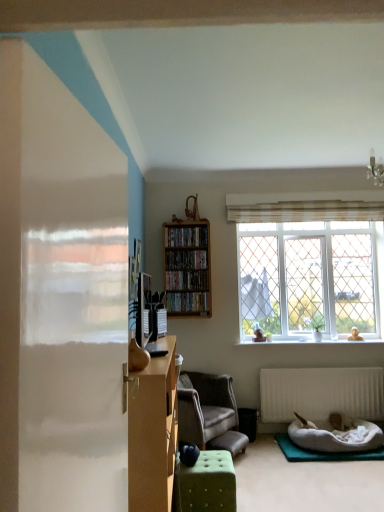
At what (x,y) coordinates should I click in order to perform the action: click on velvet grey armchair at center. Please return your answer as a coordinate pair (x, y). The width and height of the screenshot is (384, 512). Looking at the image, I should click on (209, 413).

The height and width of the screenshot is (512, 384). What do you see at coordinates (187, 280) in the screenshot?
I see `wooden bookshelf at center, acting as the 2th shelf starting from the top` at bounding box center [187, 280].

Where is `green fabric yoga mat at lower right`? This screenshot has width=384, height=512. green fabric yoga mat at lower right is located at coordinates (323, 452).

In order to click on white plush pet bed at lower right in this screenshot , I will do `click(336, 436)`.

Describe the element at coordinates (188, 302) in the screenshot. This screenshot has height=512, width=384. I see `wooden bookshelf at center, the 3th shelf positioned from the top` at that location.

Where is `velvet grey armchair at center`? The width and height of the screenshot is (384, 512). velvet grey armchair at center is located at coordinates pyautogui.click(x=209, y=413).

Between point (208, 443) and point (206, 252), which one is positioned behind?

The point (206, 252) is farther.

In the scene shown: Is green tufted ottoman at center positioned with its back to wooden bookshelf at center, placed as the 2th cabinet when sorted from top to bottom?

No, green tufted ottoman at center's orientation is not away from wooden bookshelf at center, placed as the 2th cabinet when sorted from top to bottom.

From the image's perspective, who appears lower, green tufted ottoman at center or wooden bookshelf at center, positioned as the 1th cabinet in bottom-to-top order?

green tufted ottoman at center appears lower in the image.

Who is smaller, green tufted ottoman at center or wooden bookshelf at center, placed as the 2th cabinet when sorted from top to bottom?

Smaller between the two is wooden bookshelf at center, placed as the 2th cabinet when sorted from top to bottom.

Is point (186, 432) closer or farther from the camera than point (188, 288)?

Point (186, 432) appears to be closer to the viewer than point (188, 288).

Identify the location of chair that is under the wooden bookshelf at center, acting as the 2th shelf starting from the top (from a real-world perspective). The height and width of the screenshot is (512, 384). (209, 413).

Is velvet grey armchair at center next to wooden bookshelf at center, the 2th shelf when ordered from bottom to top, and touching it?

velvet grey armchair at center and wooden bookshelf at center, the 2th shelf when ordered from bottom to top, are clearly separated.

From the image's perspective, which one is positioned lower, velvet grey armchair at center or wooden bookshelf at center, the 2th shelf when ordered from bottom to top?

velvet grey armchair at center.

Is wooden bookshelf at upper center, which appears as the first cabinet when viewed from the top, in front of wooden bookshelf at center, placed as the 2th cabinet when sorted from top to bottom?

No, it is not.

Based on the photo, can you confirm if wooden bookshelf at upper center, the second cabinet in the bottom-to-top sequence, is taller than wooden bookshelf at center, placed as the 2th cabinet when sorted from top to bottom?

Yes, wooden bookshelf at upper center, the second cabinet in the bottom-to-top sequence, is taller than wooden bookshelf at center, placed as the 2th cabinet when sorted from top to bottom.

Are wooden bookshelf at upper center, which appears as the first cabinet when viewed from the top, and wooden bookshelf at center, positioned as the 1th cabinet in bottom-to-top order, beside each other?

No.

From the image's perspective, which is above, wooden bookshelf at upper center, which appears as the first cabinet when viewed from the top, or wooden bookshelf at center, placed as the 2th cabinet when sorted from top to bottom?

wooden bookshelf at upper center, which appears as the first cabinet when viewed from the top.

From the image's perspective, which object appears higher, green fabric yoga mat at lower right or green tufted ottoman at center?

green tufted ottoman at center, from the image's perspective.

Is green fabric yoga mat at lower right facing towards green tufted ottoman at center?

No, green fabric yoga mat at lower right is not turned towards green tufted ottoman at center.

Is green fabric yoga mat at lower right far away from green tufted ottoman at center?

No, green fabric yoga mat at lower right is not far away from green tufted ottoman at center.

Can you confirm if green fabric yoga mat at lower right is taller than wooden bookshelf at center, acting as the 3th shelf starting from the bottom?

No.

Where is `yoga mat in front of the wooden bookshelf at center, which ranks as the 1th shelf in top-to-bottom order`? yoga mat in front of the wooden bookshelf at center, which ranks as the 1th shelf in top-to-bottom order is located at coordinates (323, 452).

Can we say green fabric yoga mat at lower right lies outside wooden bookshelf at center, which ranks as the 1th shelf in top-to-bottom order?

Yes.

In the scene shown: Which is more to the left, green fabric yoga mat at lower right or wooden bookshelf at center, acting as the 3th shelf starting from the bottom?

Positioned to the left is wooden bookshelf at center, acting as the 3th shelf starting from the bottom.

Locate an element on the screen. bedding on the right of wooden bookshelf at upper center, which appears as the first cabinet when viewed from the top is located at coordinates (336, 436).

Would you consider wooden bookshelf at upper center, which appears as the first cabinet when viewed from the top, to be distant from white plush pet bed at lower right?

That's right, there is a large distance between wooden bookshelf at upper center, which appears as the first cabinet when viewed from the top, and white plush pet bed at lower right.

Considering the positions of objects wooden bookshelf at upper center, which appears as the first cabinet when viewed from the top, and white plush pet bed at lower right in the image provided, who is behind, wooden bookshelf at upper center, which appears as the first cabinet when viewed from the top, or white plush pet bed at lower right?

wooden bookshelf at upper center, which appears as the first cabinet when viewed from the top, is further from the camera.

Measure the distance from wooden bookshelf at upper center, which appears as the first cabinet when viewed from the top, to white plush pet bed at lower right.

They are 7.10 feet apart.

Does wooden bookshelf at center, the 2th shelf when ordered from bottom to top, contain green tufted ottoman at center?

No, green tufted ottoman at center is not inside wooden bookshelf at center, the 2th shelf when ordered from bottom to top.

In terms of height, does wooden bookshelf at center, the 2th shelf when ordered from bottom to top, look taller or shorter compared to green tufted ottoman at center?

wooden bookshelf at center, the 2th shelf when ordered from bottom to top, is taller than green tufted ottoman at center.

Considering the relative sizes of wooden bookshelf at center, acting as the 2th shelf starting from the top, and green tufted ottoman at center in the image provided, is wooden bookshelf at center, acting as the 2th shelf starting from the top, bigger than green tufted ottoman at center?

Actually, wooden bookshelf at center, acting as the 2th shelf starting from the top, might be smaller than green tufted ottoman at center.

Is wooden bookshelf at center, the 2th shelf when ordered from bottom to top, further to the viewer compared to green tufted ottoman at center?

Yes, wooden bookshelf at center, the 2th shelf when ordered from bottom to top, is behind green tufted ottoman at center.

Where is `the footrest below the wooden bookshelf at center, placed as the 2th cabinet when sorted from top to bottom (from a real-world perspective)`? the footrest below the wooden bookshelf at center, placed as the 2th cabinet when sorted from top to bottom (from a real-world perspective) is located at coordinates [x=229, y=442].

From the image's perspective, count 2nd shelfs upward from the velvet grey armchair at center and point to it. Please provide its 2D coordinates.

[(187, 280)]

Considering their positions, is velvet grey armchair at center positioned further to white plush pet bed at lower right than white matte radiator at lower center?

velvet grey armchair at center.

From the image, which object appears to be nearer to green tufted ottoman at center, white plush pet bed at lower right or wooden cabinet at center-left?

white plush pet bed at lower right is positioned closer to the anchor green tufted ottoman at center.

Based on the photo, based on their spatial positions, is wooden bookshelf at center, acting as the 3th shelf starting from the bottom, or white plush pet bed at lower right closer to green fabric ottoman at lower center?

white plush pet bed at lower right.

Estimate the real-world distances between objects in this image. Which object is further from wooden bookshelf at center, positioned as the 1th cabinet in bottom-to-top order, green fabric ottoman at lower center or white plush pet bed at lower right?

Based on the image, green fabric ottoman at lower center appears to be further to wooden bookshelf at center, positioned as the 1th cabinet in bottom-to-top order.

Considering their positions, is white matte radiator at lower center positioned further to velvet grey armchair at center than wooden bookshelf at center, the 1th shelf from the bottom?

wooden bookshelf at center, the 1th shelf from the bottom.

When comparing their distances from velvet grey armchair at center, does green tufted ottoman at center or white matte radiator at lower center seem closer?

green tufted ottoman at center.

When comparing their distances from velvet grey armchair at center, does green tufted ottoman at center or green fabric ottoman at lower center seem further?

The object further to velvet grey armchair at center is green fabric ottoman at lower center.

Considering their positions, is wooden bookshelf at upper center, which appears as the first cabinet when viewed from the top, positioned further to wooden cabinet at center-left than wooden bookshelf at center, placed as the 2th cabinet when sorted from top to bottom?

wooden bookshelf at upper center, which appears as the first cabinet when viewed from the top, lies further to wooden cabinet at center-left than the other object.

Image resolution: width=384 pixels, height=512 pixels. I want to click on yoga mat positioned between green fabric ottoman at lower center and white matte radiator at lower center from near to far, so click(323, 452).

Locate an element on the screen. The width and height of the screenshot is (384, 512). shelf located between wooden cabinet at center-left and wooden bookshelf at center, which ranks as the 1th shelf in top-to-bottom order, in the depth direction is located at coordinates (188, 302).

I want to click on chair located between wooden cabinet at center-left and wooden bookshelf at center, the 3th shelf positioned from the top, in the depth direction, so click(x=209, y=413).

I want to click on radiator between wooden bookshelf at center, acting as the 3th shelf starting from the bottom, and green tufted ottoman at center in the up-down direction, so click(x=321, y=393).